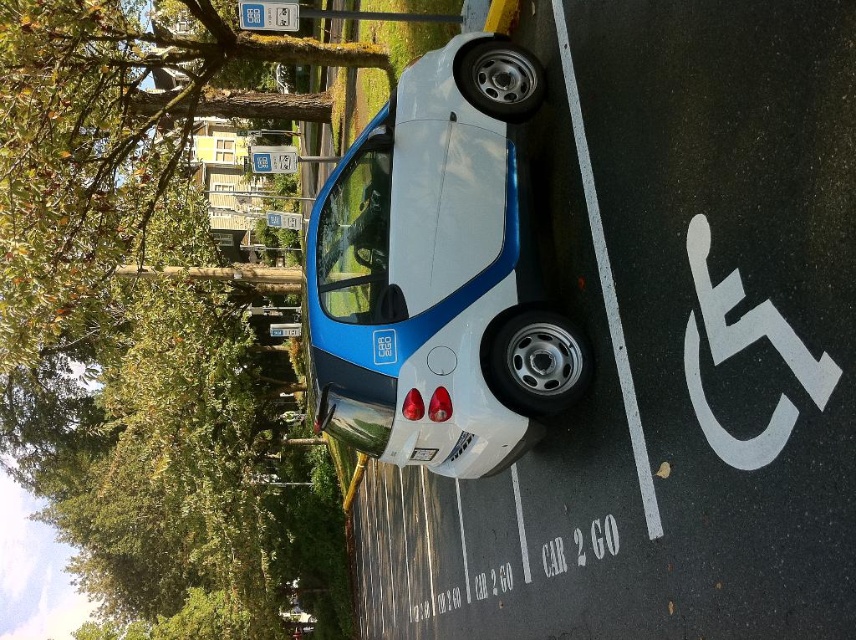
Question: Does metallic blue car at center have a larger size compared to white plastic parking sign at center?

Choices:
 (A) yes
 (B) no

Answer: (A)

Question: Which object is closer to the camera taking this photo?

Choices:
 (A) white plastic parking sign at center
 (B) metallic blue car at center

Answer: (B)

Question: Can you confirm if metallic blue car at center is positioned below white plastic parking sign at center?

Choices:
 (A) no
 (B) yes

Answer: (A)

Question: Is metallic blue car at center above white plastic parking sign at center?

Choices:
 (A) no
 (B) yes

Answer: (B)

Question: Which point is closer to the camera taking this photo?

Choices:
 (A) (490, 573)
 (B) (480, 432)

Answer: (B)